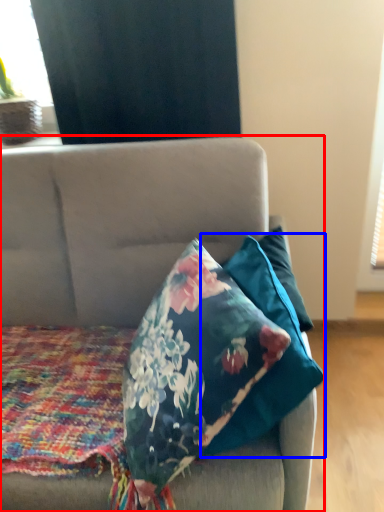
Question: Among these objects, which one is nearest to the camera, studio couch (highlighted by a red box) or pillow (highlighted by a blue box)?

Choices:
 (A) studio couch
 (B) pillow

Answer: (A)